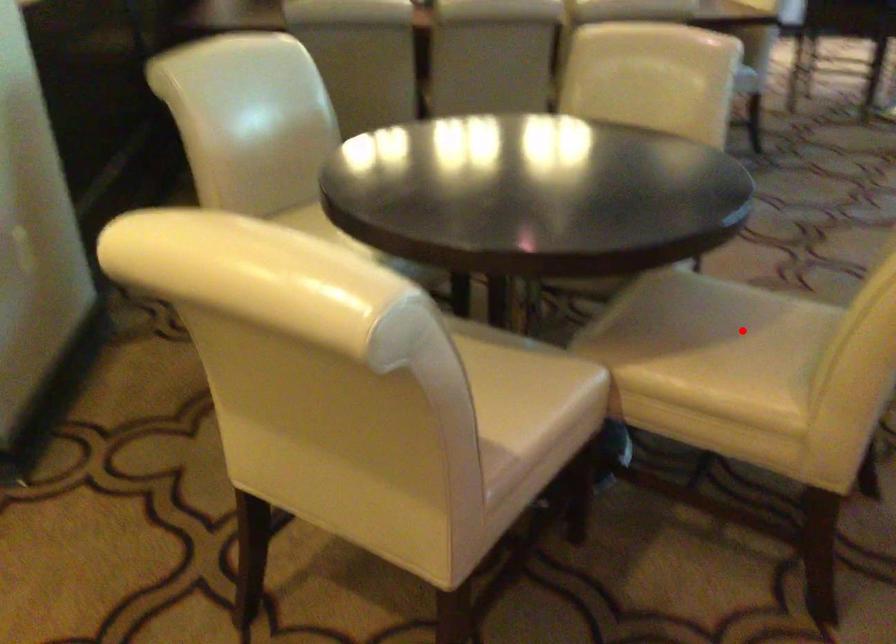
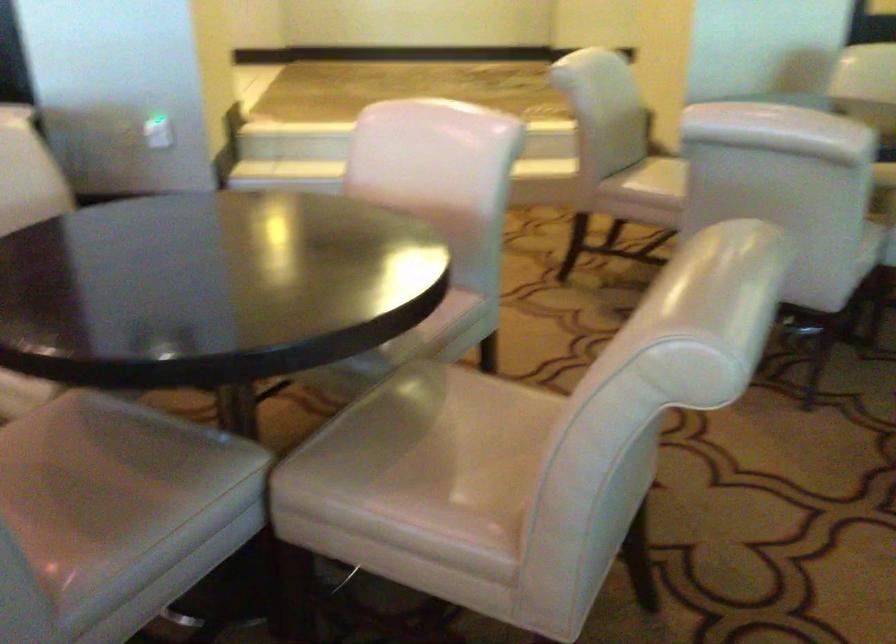
Question: I am providing you with two images of the same scene from different viewpoints. A red point is marked on the first image. Is the red point's position out of view in image 2?

Choices:
 (A) Yes
 (B) No

Answer: (A)